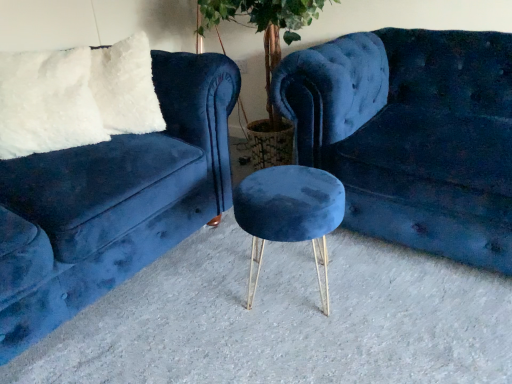
Question: Would you say velvet blue stool at center is to the left or to the right of velvet blue couch at center, arranged as the first studio couch when viewed from the right, in the picture?

Choices:
 (A) right
 (B) left

Answer: (B)

Question: From a real-world perspective, is velvet blue stool at center positioned above or below velvet blue couch at center, arranged as the first studio couch when viewed from the right?

Choices:
 (A) above
 (B) below

Answer: (B)

Question: Which object is the farthest from the velvet blue couch at center, placed as the 2th studio couch when sorted from left to right?

Choices:
 (A) velvet blue couch at left, the second studio couch when ordered from right to left
 (B) white fluffy pillow at upper left
 (C) velvet blue stool at center

Answer: (B)

Question: Which of these objects is positioned farthest from the velvet blue stool at center?

Choices:
 (A) white fluffy pillow at upper left
 (B) velvet blue couch at center, placed as the 2th studio couch when sorted from left to right
 (C) velvet blue couch at left, the first studio couch when ordered from left to right

Answer: (A)